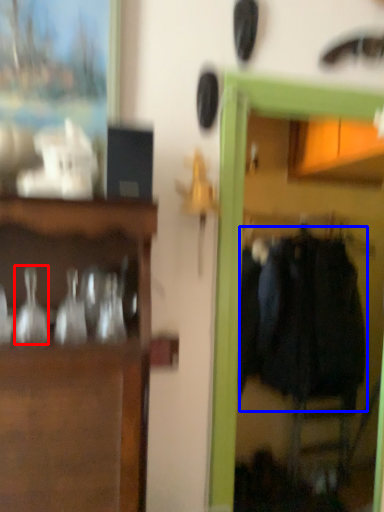
Question: Which object is closer to the camera taking this photo, glass vase (highlighted by a red box) or clothing (highlighted by a blue box)?

Choices:
 (A) glass vase
 (B) clothing

Answer: (A)